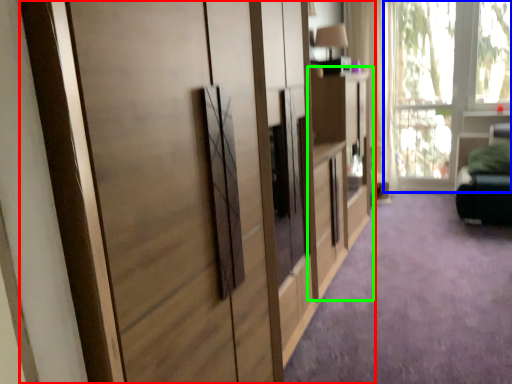
Question: Which object is the closest to the cupboard (highlighted by a red box)? Choose among these: window (highlighted by a blue box) or dresser (highlighted by a green box).

Choices:
 (A) window
 (B) dresser

Answer: (B)